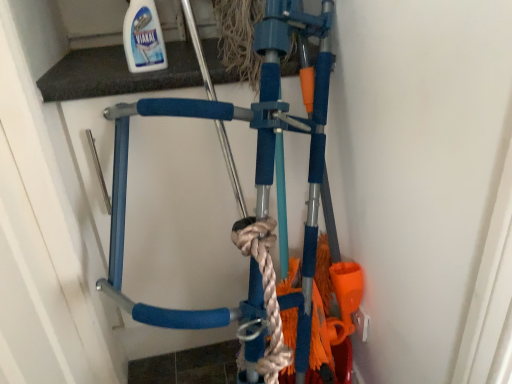
Question: Would you say blue foam bicycle at center is outside white glossy bottle at upper center?

Choices:
 (A) no
 (B) yes

Answer: (B)

Question: From a real-world perspective, does blue foam bicycle at center stand above white glossy bottle at upper center?

Choices:
 (A) yes
 (B) no

Answer: (B)

Question: Could you tell me if blue foam bicycle at center is turned towards white glossy bottle at upper center?

Choices:
 (A) yes
 (B) no

Answer: (B)

Question: Is blue foam bicycle at center far away from white glossy bottle at upper center?

Choices:
 (A) yes
 (B) no

Answer: (B)

Question: Does blue foam bicycle at center have a lesser height compared to white glossy bottle at upper center?

Choices:
 (A) yes
 (B) no

Answer: (B)

Question: Is blue foam bicycle at center oriented away from white glossy bottle at upper center?

Choices:
 (A) no
 (B) yes

Answer: (A)

Question: Considering the relative sizes of white glossy bottle at upper center and blue foam bicycle at center in the image provided, is white glossy bottle at upper center taller than blue foam bicycle at center?

Choices:
 (A) no
 (B) yes

Answer: (A)

Question: Is white glossy bottle at upper center in contact with blue foam bicycle at center?

Choices:
 (A) yes
 (B) no

Answer: (B)

Question: Is blue foam bicycle at center at the back of white glossy bottle at upper center?

Choices:
 (A) no
 (B) yes

Answer: (A)

Question: Can you confirm if white glossy bottle at upper center is bigger than blue foam bicycle at center?

Choices:
 (A) no
 (B) yes

Answer: (A)

Question: Considering the relative positions of white glossy bottle at upper center and blue foam bicycle at center in the image provided, is white glossy bottle at upper center in front of blue foam bicycle at center?

Choices:
 (A) yes
 (B) no

Answer: (A)

Question: Can blue foam bicycle at center be found inside white glossy bottle at upper center?

Choices:
 (A) no
 (B) yes

Answer: (A)

Question: Relative to blue foam bicycle at center, is white glossy bottle at upper center in front or behind?

Choices:
 (A) behind
 (B) front

Answer: (B)